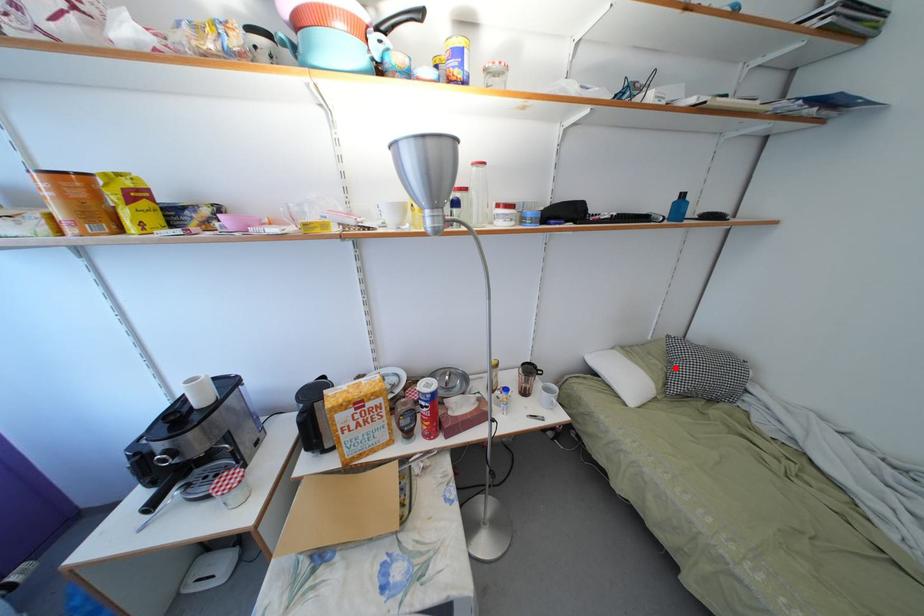
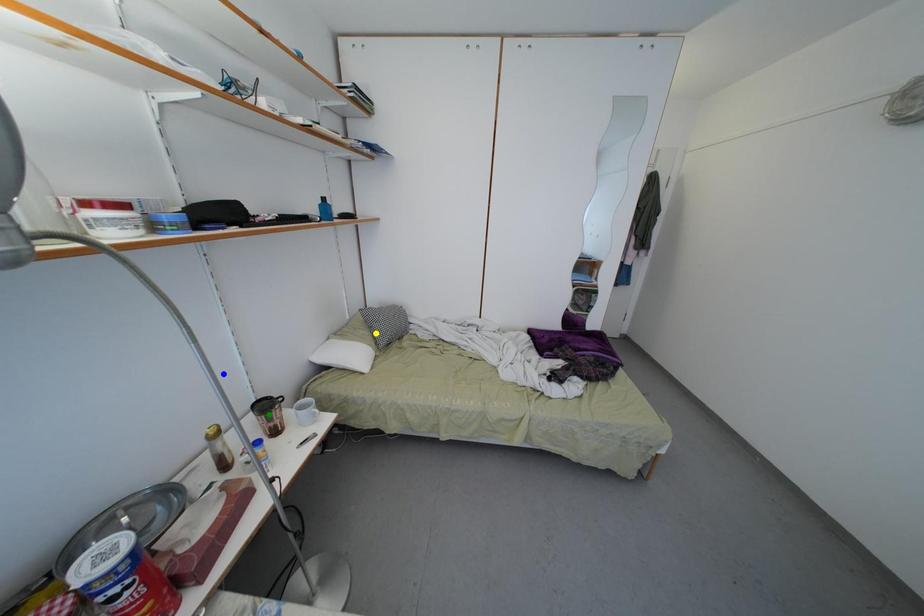
Question: I am providing you with two images of the same scene from different viewpoints. A red point is marked on the first image. You are given multiple points on the second image. Which mark in image 2 goes with the point in image 1?

Choices:
 (A) yellow point
 (B) green point
 (C) blue point

Answer: (A)